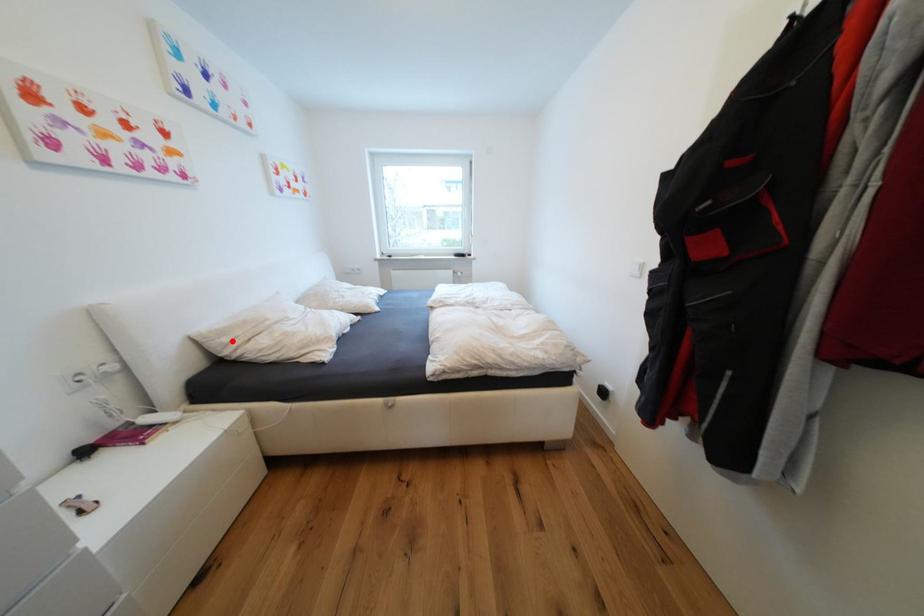
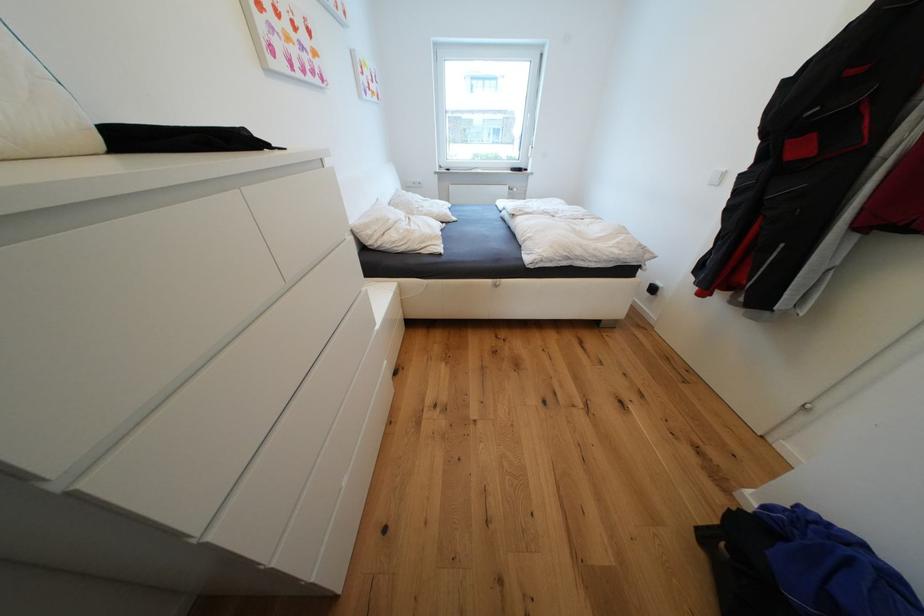
Find the pixel in the second image that matches the highlighted location in the first image.

(377, 233)